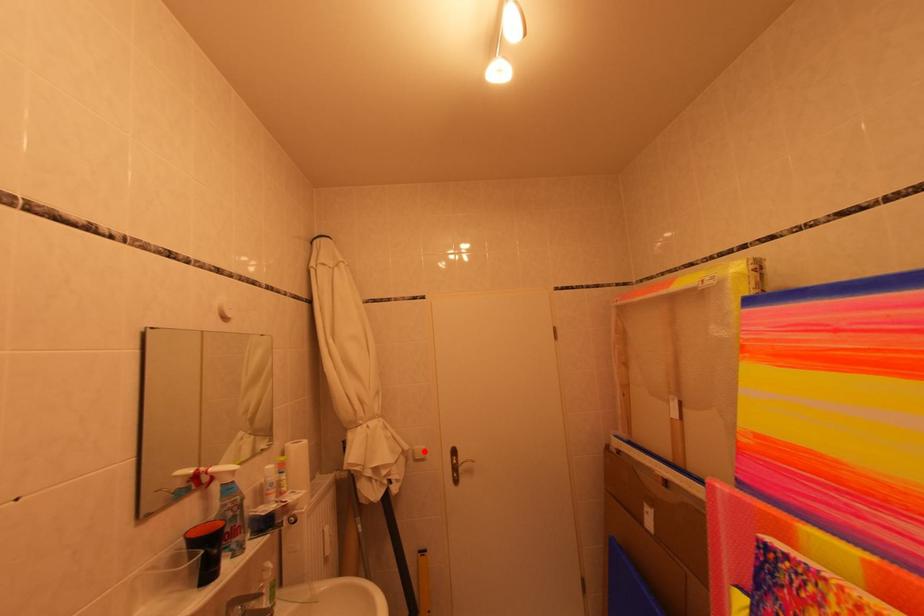
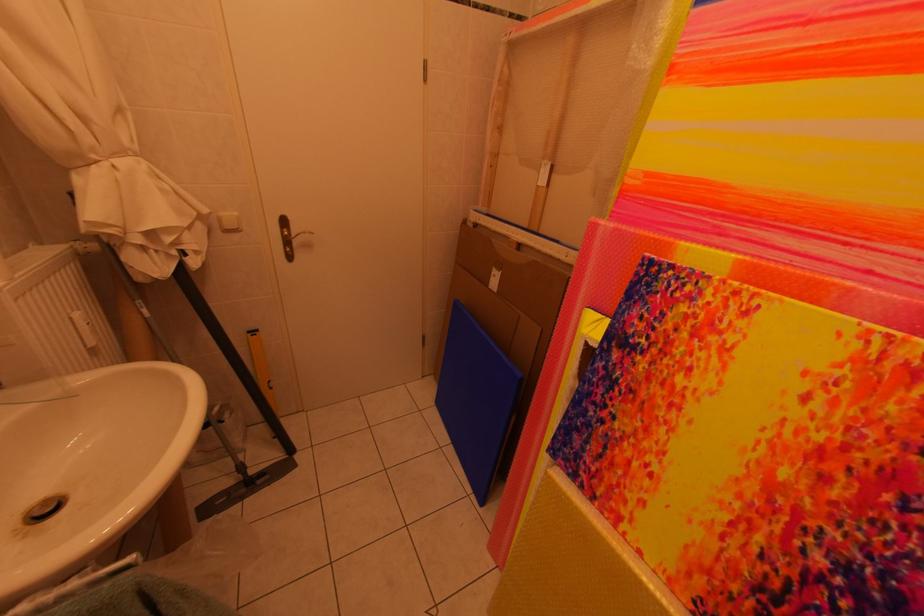
In the second image, find the point that corresponds to the highlighted location in the first image.

(229, 217)